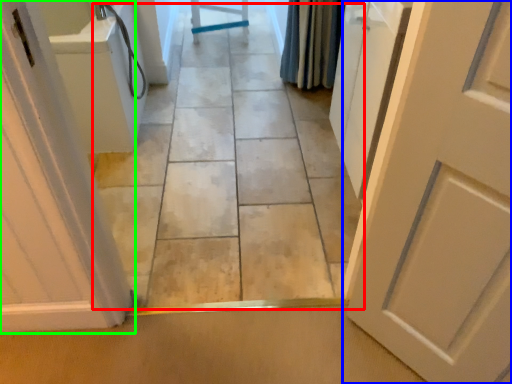
Question: Estimate the real-world distances between objects in this image. Which object is closer to path (highlighted by a red box), door (highlighted by a blue box) or door (highlighted by a green box)?

Choices:
 (A) door
 (B) door

Answer: (B)